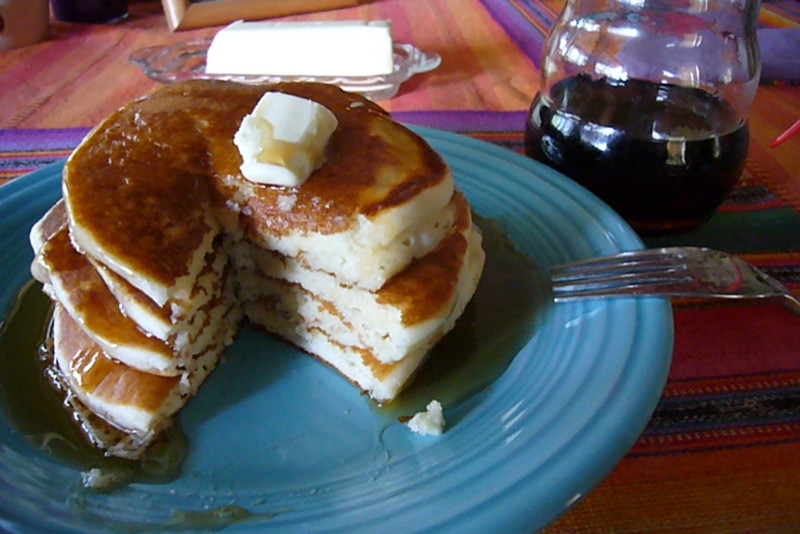
This screenshot has height=534, width=800. What are the coordinates of `plate` in the screenshot? It's located at (612, 400).